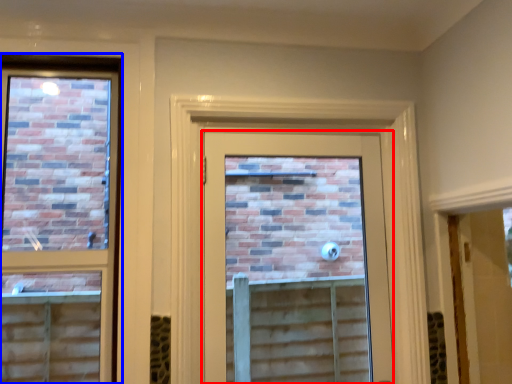
Question: Among these objects, which one is farthest to the camera, door (highlighted by a red box) or window (highlighted by a blue box)?

Choices:
 (A) door
 (B) window

Answer: (A)